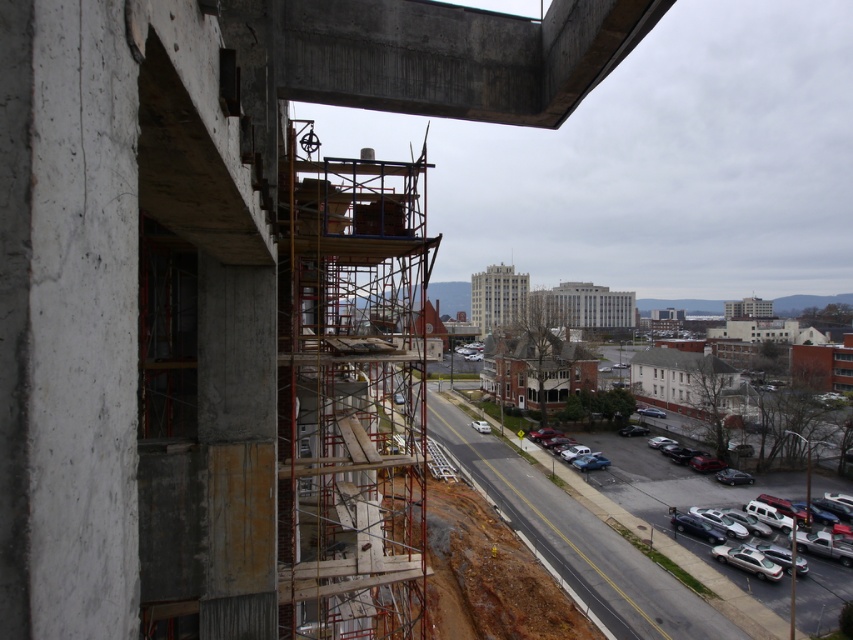
Which is behind, point (602, 29) or point (796, 547)?

Point (796, 547)

I want to click on concrete overpass at upper center, so click(431, 54).